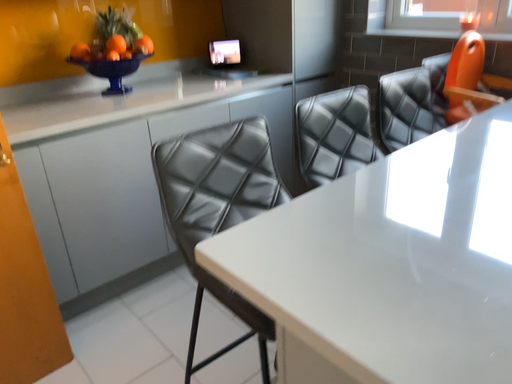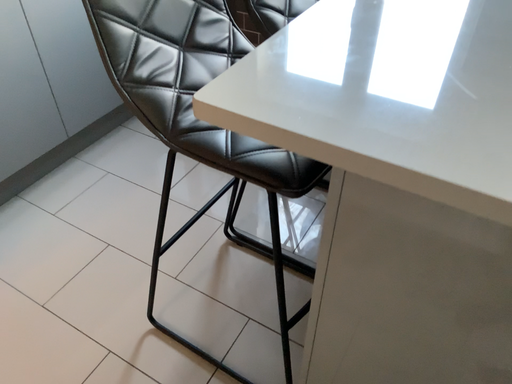
Question: How did the camera likely rotate when shooting the video?

Choices:
 (A) rotated right
 (B) rotated left

Answer: (A)